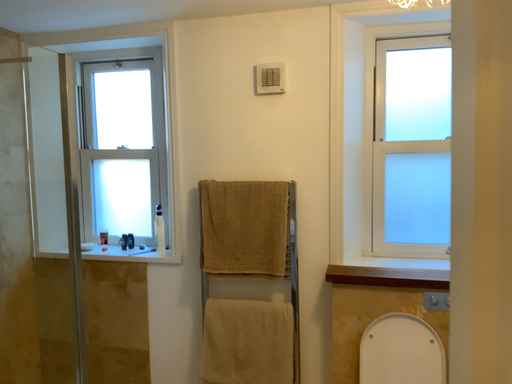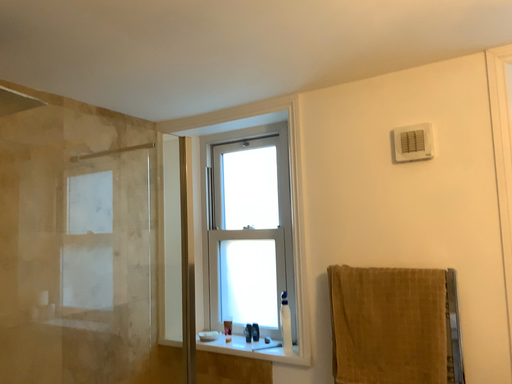
Question: Which way did the camera rotate in the video?

Choices:
 (A) rotated left
 (B) rotated right

Answer: (A)